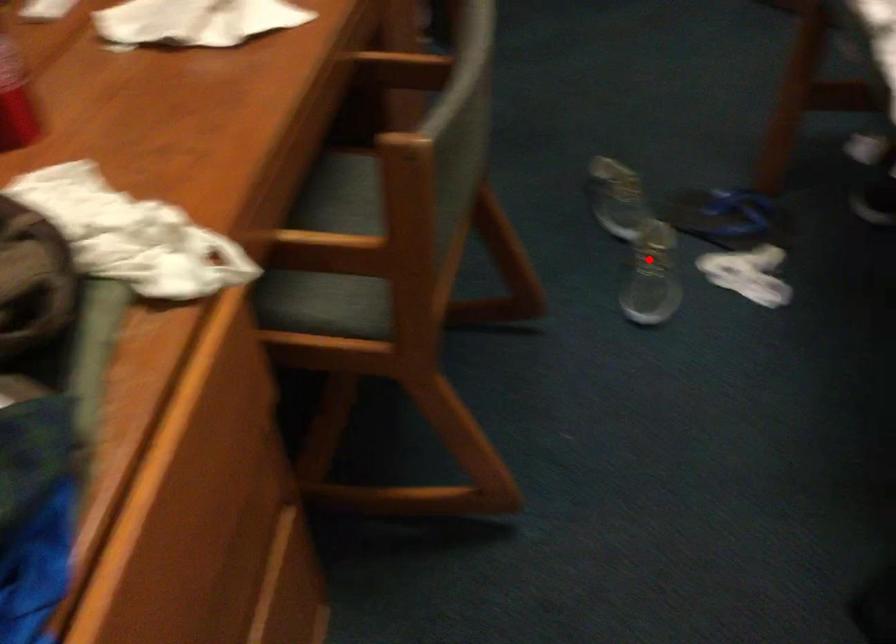
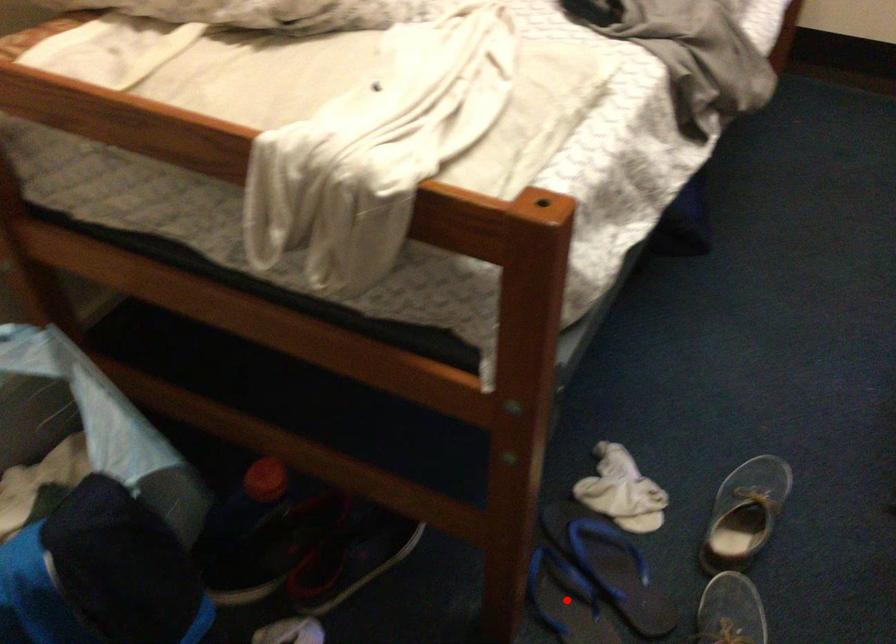
I am providing you with two images of the same scene from different viewpoints. A red point is marked on the first image and another point is marked on the second image. Do the highlighted points in image1 and image2 indicate the same real-world spot?

No